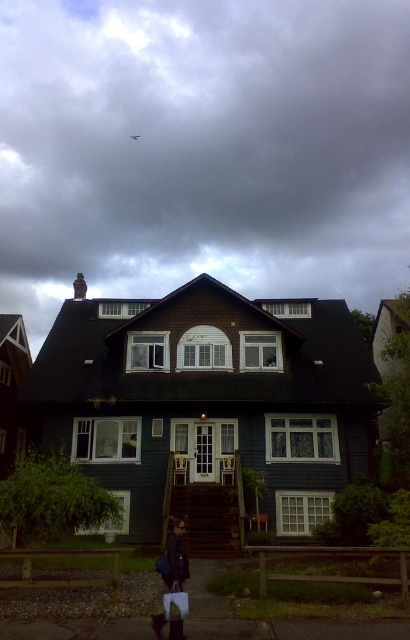
Question: Can you confirm if dark gray cloud at upper center is bigger than dark wood house at center?

Choices:
 (A) no
 (B) yes

Answer: (B)

Question: Is dark gray cloud at upper center thinner than dark wood house at center?

Choices:
 (A) yes
 (B) no

Answer: (B)

Question: Estimate the real-world distances between objects in this image. Which object is closer to the dark wood house at center?

Choices:
 (A) dark blue fabric bag at lower center
 (B) dark gray cloud at upper center
 (C) metallic gray plane at upper center

Answer: (A)

Question: Among these objects, which one is farthest from the camera?

Choices:
 (A) dark blue fabric bag at lower center
 (B) dark gray cloud at upper center
 (C) metallic gray plane at upper center
 (D) dark wood house at center

Answer: (C)

Question: Which of these objects is positioned farthest from the dark blue fabric bag at lower center?

Choices:
 (A) metallic gray plane at upper center
 (B) dark wood house at center

Answer: (A)

Question: Considering the relative positions of dark blue fabric bag at lower center and metallic gray plane at upper center in the image provided, where is dark blue fabric bag at lower center located with respect to metallic gray plane at upper center?

Choices:
 (A) below
 (B) above

Answer: (A)